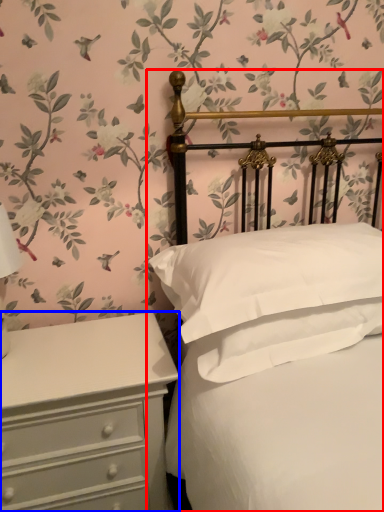
Question: Which object is further to the camera taking this photo, bed (highlighted by a red box) or chest of drawers (highlighted by a blue box)?

Choices:
 (A) bed
 (B) chest of drawers

Answer: (B)